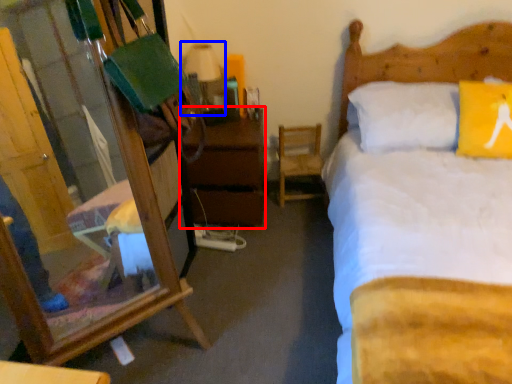
Question: Which point is further to the camera, nightstand (highlighted by a red box) or table lamp (highlighted by a blue box)?

Choices:
 (A) nightstand
 (B) table lamp

Answer: (B)